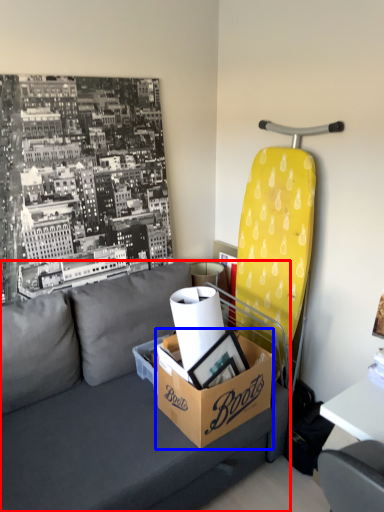
Question: Which object appears farthest to the camera in this image, studio couch (highlighted by a red box) or box (highlighted by a blue box)?

Choices:
 (A) studio couch
 (B) box

Answer: (B)